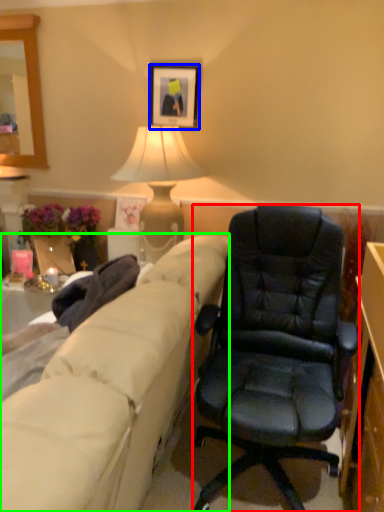
Question: Which is farther away from chair (highlighted by a red box)? picture frame (highlighted by a blue box) or studio couch (highlighted by a green box)?

Choices:
 (A) picture frame
 (B) studio couch

Answer: (A)